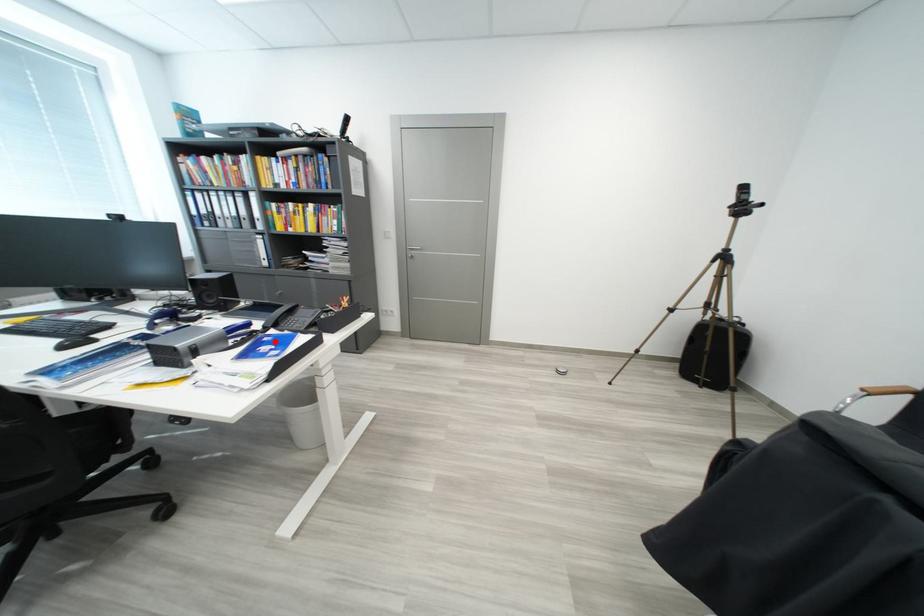
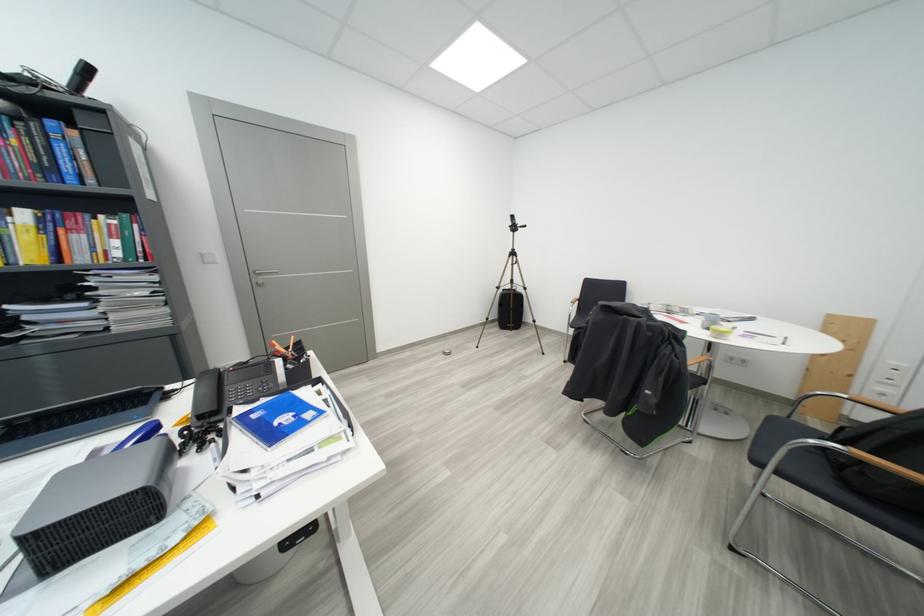
The point at the highlighted location is marked in the first image. Where is the corresponding point in the second image?

(263, 419)